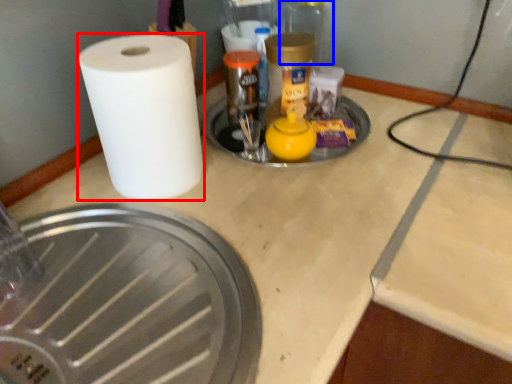
Question: Among these objects, which one is farthest to the camera, paper towel (highlighted by a red box) or glass jar (highlighted by a blue box)?

Choices:
 (A) paper towel
 (B) glass jar

Answer: (B)